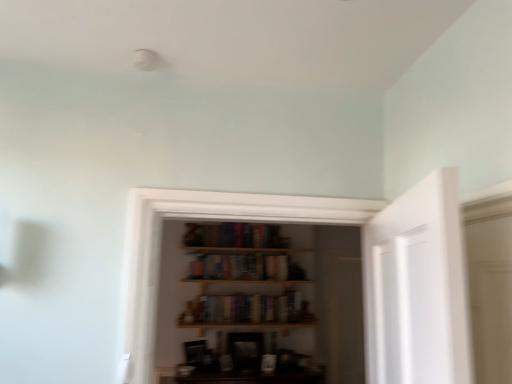
Find the location of `vacant space situated above hardcover books at center, the 2th book when ordered from top to bottom (from a real-world perspective)`. vacant space situated above hardcover books at center, the 2th book when ordered from top to bottom (from a real-world perspective) is located at coordinates (246, 294).